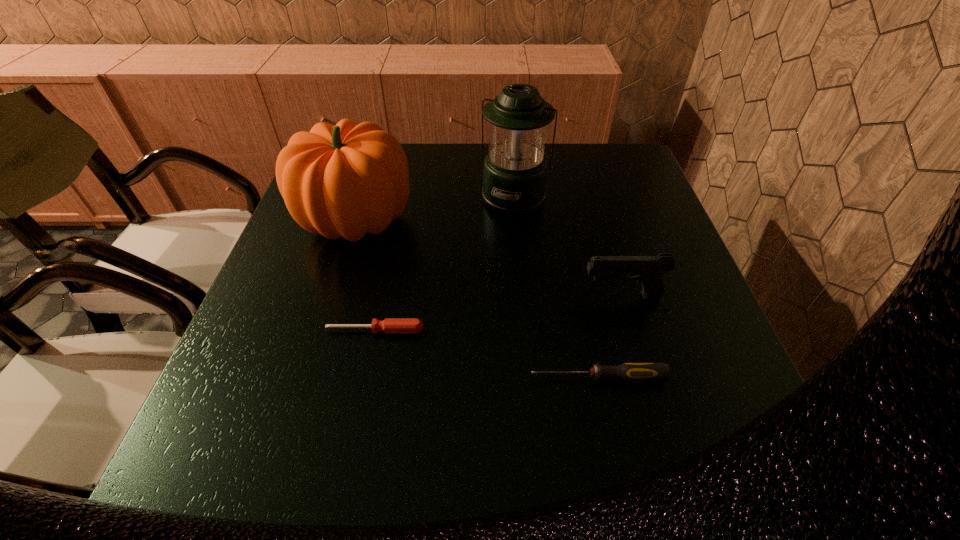
Locate an element on the screen. object that can be found as the closest to the pumpkin is located at coordinates 514,178.

Find the location of a particular element. the fourth closest object to the pumpkin is located at coordinates (648, 269).